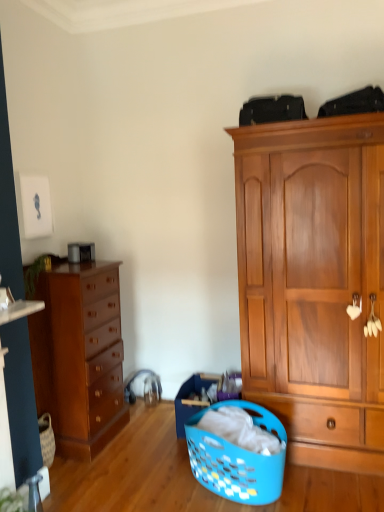
Question: Is wooden cabinet at right oriented away from shiny brown dresser at left?

Choices:
 (A) yes
 (B) no

Answer: (B)

Question: From a real-world perspective, is wooden cabinet at right positioned under shiny brown dresser at left based on gravity?

Choices:
 (A) yes
 (B) no

Answer: (B)

Question: From the image's perspective, is wooden cabinet at right on top of shiny brown dresser at left?

Choices:
 (A) yes
 (B) no

Answer: (A)

Question: Is the depth of wooden cabinet at right less than that of shiny brown dresser at left?

Choices:
 (A) yes
 (B) no

Answer: (A)

Question: Is wooden cabinet at right placed right next to shiny brown dresser at left?

Choices:
 (A) yes
 (B) no

Answer: (B)

Question: From the image's perspective, is wooden cabinet at right above or below shiny brown dresser at left?

Choices:
 (A) below
 (B) above

Answer: (B)

Question: Is point (362, 353) closer or farther from the camera than point (39, 313)?

Choices:
 (A) closer
 (B) farther

Answer: (A)

Question: Which is correct: wooden cabinet at right is inside shiny brown dresser at left, or outside of it?

Choices:
 (A) outside
 (B) inside

Answer: (A)

Question: Considering their positions, is wooden cabinet at right located in front of or behind shiny brown dresser at left?

Choices:
 (A) front
 (B) behind

Answer: (A)

Question: In terms of size, does blue plastic laundry basket at lower center appear bigger or smaller than shiny brown dresser at left?

Choices:
 (A) small
 (B) big

Answer: (A)

Question: From the image's perspective, is blue plastic laundry basket at lower center located above or below shiny brown dresser at left?

Choices:
 (A) above
 (B) below

Answer: (B)

Question: From a real-world perspective, is blue plastic laundry basket at lower center above or below shiny brown dresser at left?

Choices:
 (A) above
 (B) below

Answer: (B)

Question: In the image, is blue plastic laundry basket at lower center positioned in front of or behind shiny brown dresser at left?

Choices:
 (A) front
 (B) behind

Answer: (A)

Question: Is shiny brown dresser at left bigger or smaller than wooden cabinet at right?

Choices:
 (A) big
 (B) small

Answer: (B)

Question: Relative to wooden cabinet at right, is shiny brown dresser at left in front or behind?

Choices:
 (A) front
 (B) behind

Answer: (B)